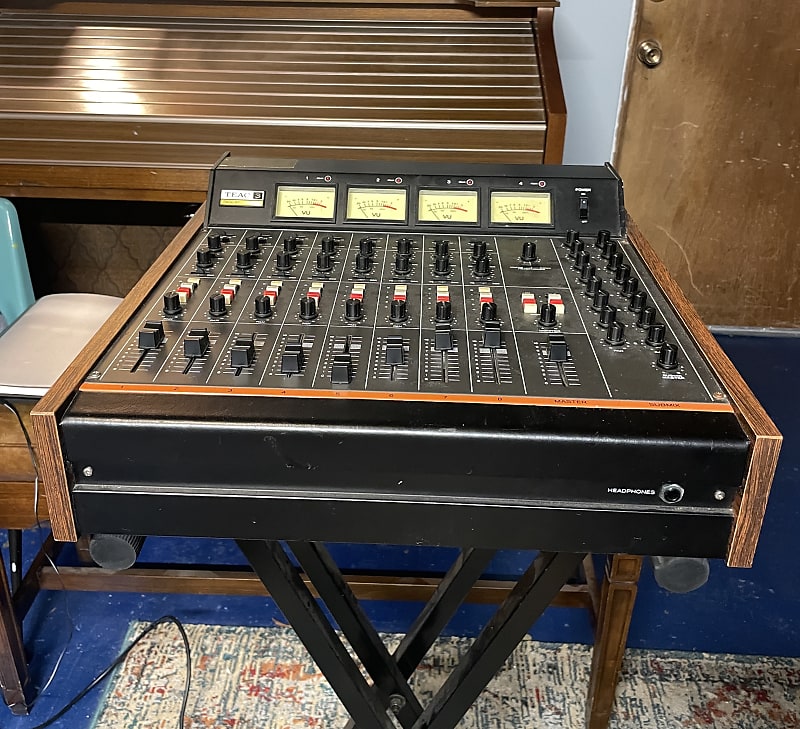
Locate an element on the screen. Image resolution: width=800 pixels, height=729 pixels. black stand is located at coordinates (336, 655), (373, 646), (445, 604), (474, 641).